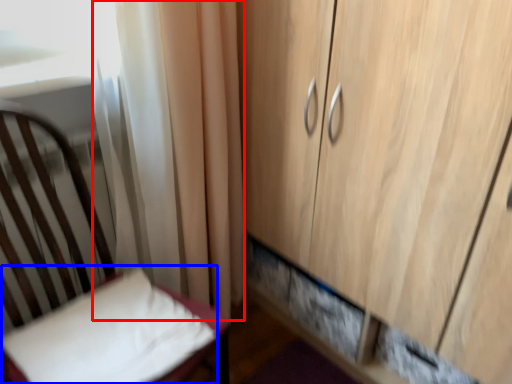
Question: Which of the following is the farthest to the observer, curtain (highlighted by a red box) or pillow (highlighted by a blue box)?

Choices:
 (A) curtain
 (B) pillow

Answer: (A)